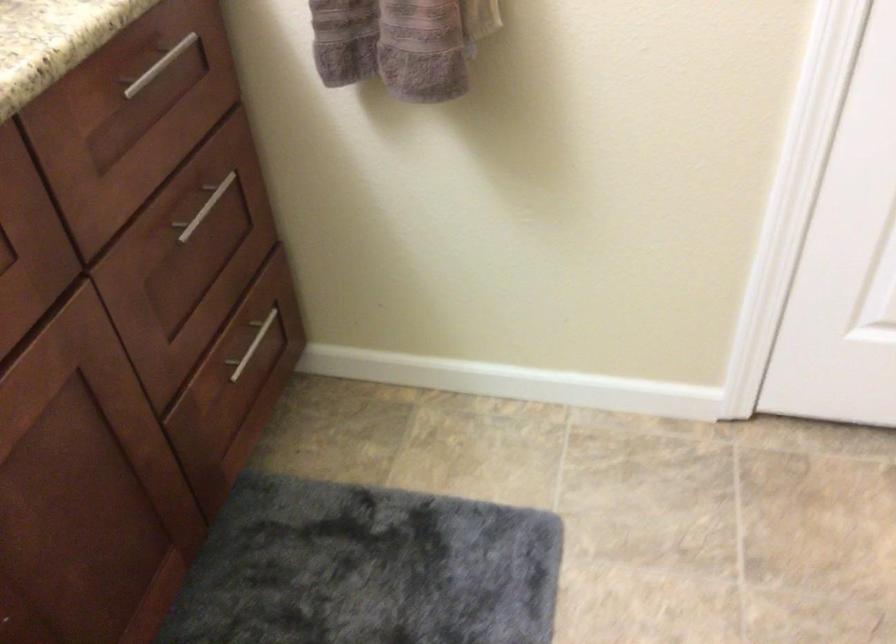
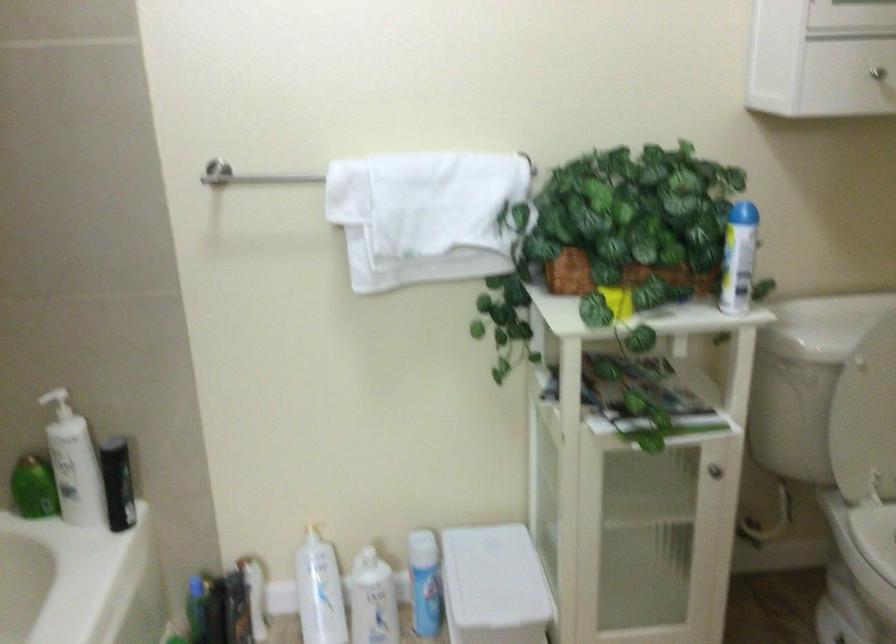
The first image is from the beginning of the video and the second image is from the end. How did the camera likely rotate when shooting the video?

The rotation direction of the camera is right-down.